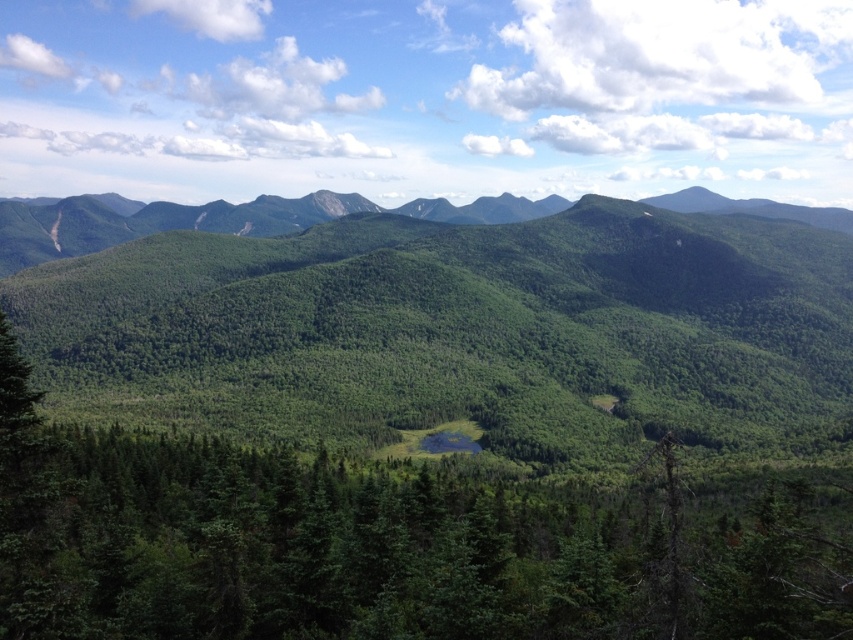
Based on the photo, can you confirm if green forested mountain range at center is thinner than green matte tree at center?

In fact, green forested mountain range at center might be wider than green matte tree at center.

Can you confirm if green forested mountain range at center is positioned to the left of green matte tree at center?

In fact, green forested mountain range at center is to the right of green matte tree at center.

What do you see at coordinates (457, 330) in the screenshot?
I see `green forested mountain range at center` at bounding box center [457, 330].

Find the location of `green forested mountain range at center`. green forested mountain range at center is located at coordinates (457, 330).

How distant is green forested mountain range at center from green forested mountain range at upper center?

A distance of 196.04 meters exists between green forested mountain range at center and green forested mountain range at upper center.

Can you confirm if green forested mountain range at center is positioned to the right of green forested mountain range at upper center?

Indeed, green forested mountain range at center is positioned on the right side of green forested mountain range at upper center.

Is point (399, 349) farther from camera compared to point (508, 209)?

No, (399, 349) is in front of (508, 209).

Image resolution: width=853 pixels, height=640 pixels. What are the coordinates of `green forested mountain range at center` in the screenshot? It's located at (457, 330).

Does green matte tree at center have a larger size compared to green forested mountain range at upper center?

No, green matte tree at center is not bigger than green forested mountain range at upper center.

Does green matte tree at center have a greater width compared to green forested mountain range at upper center?

No, green matte tree at center is not wider than green forested mountain range at upper center.

Between point (74, 557) and point (102, 220), which one is positioned in front?

Point (74, 557) is in front.

You are a GUI agent. You are given a task and a screenshot of the screen. Output one action in this format:
    pyautogui.click(x=<x>, y=<y>)
    Task: Click on the green matte tree at center
    This screenshot has width=853, height=640.
    Given the screenshot: What is the action you would take?
    pyautogui.click(x=387, y=545)